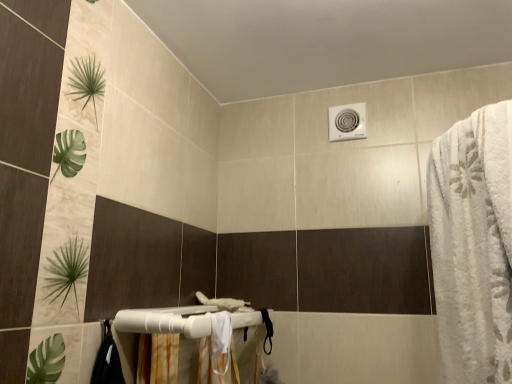
Question: Considering the relative positions of white fabric shower curtain at lower center and white fluffy bath towel at right in the image provided, is white fabric shower curtain at lower center to the right of white fluffy bath towel at right from the viewer's perspective?

Choices:
 (A) no
 (B) yes

Answer: (A)

Question: Can you confirm if white fabric shower curtain at lower center is positioned to the left of white fluffy bath towel at right?

Choices:
 (A) no
 (B) yes

Answer: (B)

Question: Is white fabric shower curtain at lower center further to the viewer compared to white fluffy bath towel at right?

Choices:
 (A) yes
 (B) no

Answer: (A)

Question: Is white fabric shower curtain at lower center not close to white fluffy bath towel at right?

Choices:
 (A) yes
 (B) no

Answer: (B)

Question: From the image's perspective, does white fabric shower curtain at lower center appear higher than white fluffy bath towel at right?

Choices:
 (A) yes
 (B) no

Answer: (B)

Question: Is white fabric shower curtain at lower center taller or shorter than white plastic towel bar at lower center?

Choices:
 (A) tall
 (B) short

Answer: (A)

Question: From a real-world perspective, is white fabric shower curtain at lower center physically located above or below white plastic towel bar at lower center?

Choices:
 (A) below
 (B) above

Answer: (A)

Question: In terms of size, does white fabric shower curtain at lower center appear bigger or smaller than white plastic towel bar at lower center?

Choices:
 (A) small
 (B) big

Answer: (A)

Question: Would you say white fabric shower curtain at lower center is to the left or to the right of white plastic towel bar at lower center in the picture?

Choices:
 (A) left
 (B) right

Answer: (B)

Question: Considering their positions, is white plastic towel bar at lower center located in front of or behind white fabric shower curtain at lower center?

Choices:
 (A) front
 (B) behind

Answer: (A)

Question: In terms of size, does white plastic towel bar at lower center appear bigger or smaller than white fabric shower curtain at lower center?

Choices:
 (A) small
 (B) big

Answer: (B)

Question: Is white plastic towel bar at lower center to the left or to the right of white fabric shower curtain at lower center in the image?

Choices:
 (A) left
 (B) right

Answer: (A)

Question: Is white plastic towel bar at lower center taller or shorter than white fabric shower curtain at lower center?

Choices:
 (A) tall
 (B) short

Answer: (B)

Question: Considering the positions of point (462, 187) and point (160, 322), is point (462, 187) closer or farther from the camera than point (160, 322)?

Choices:
 (A) closer
 (B) farther

Answer: (A)

Question: Considering the relative positions of white fluffy bath towel at right and white plastic towel bar at lower center in the image provided, is white fluffy bath towel at right to the left or to the right of white plastic towel bar at lower center?

Choices:
 (A) right
 (B) left

Answer: (A)